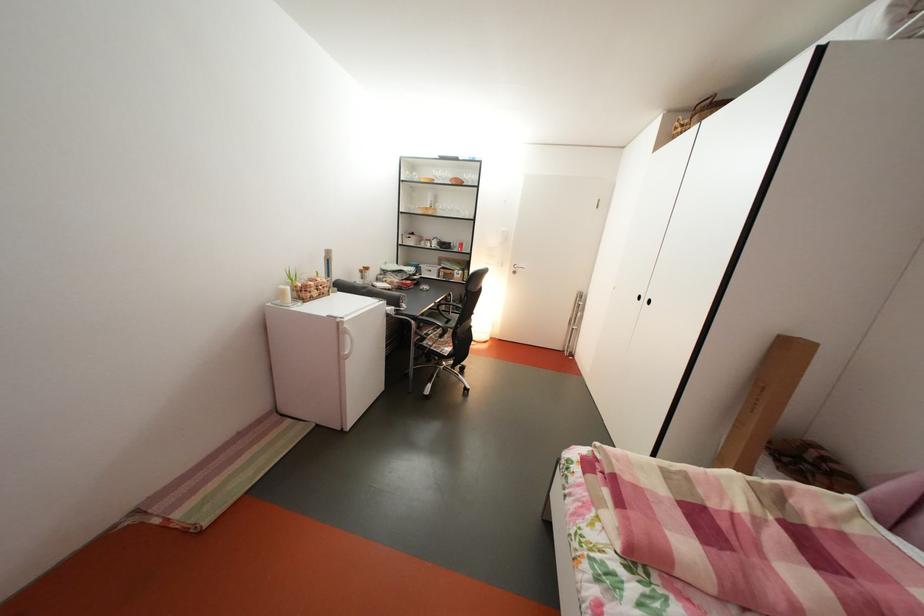
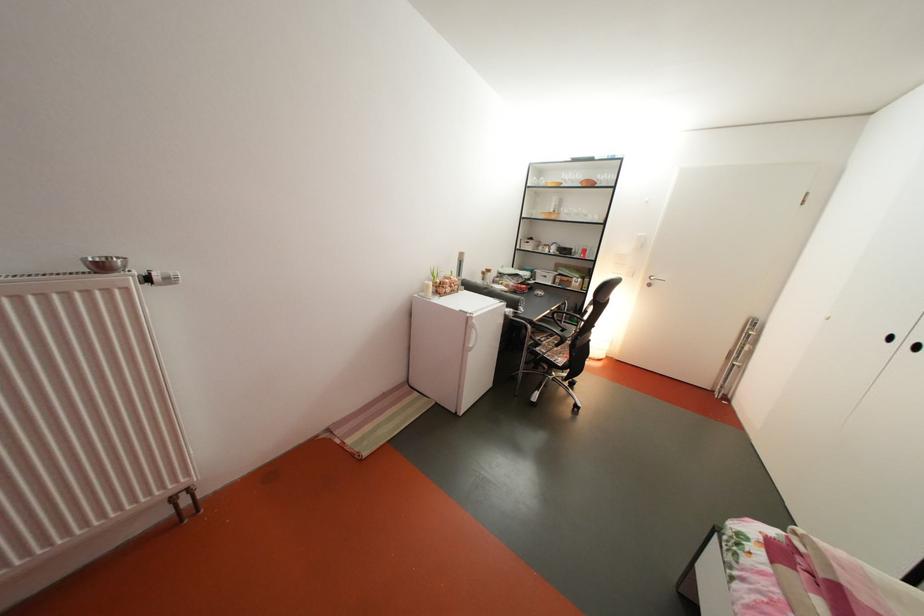
Question: The camera is either moving clockwise (left) or counter-clockwise (right) around the object. The first image is from the beginning of the video and the second image is from the end. Is the camera moving left or right when shooting the video?

Choices:
 (A) Left
 (B) Right

Answer: (B)